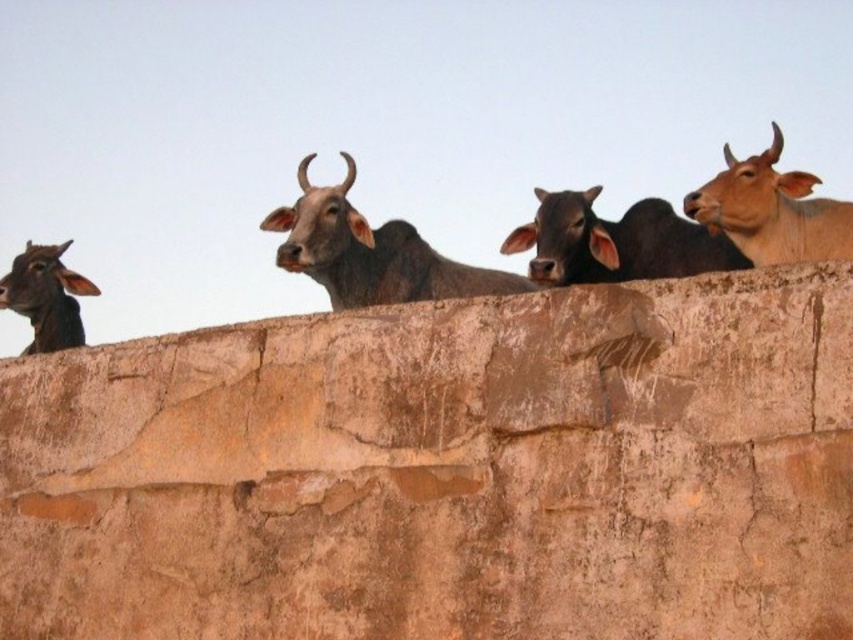
Does shiny brown bull at center have a lesser height compared to light brown smooth cow at upper right?

Indeed, shiny brown bull at center has a lesser height compared to light brown smooth cow at upper right.

Who is lower down, shiny brown bull at center or light brown smooth cow at upper right?

shiny brown bull at center is below.

Is point (344, 193) positioned in front of point (837, 240)?

That is False.

You are a GUI agent. You are given a task and a screenshot of the screen. Output one action in this format:
    pyautogui.click(x=<x>, y=<y>)
    Task: Click on the shiny brown bull at center
    The image size is (853, 640).
    Given the screenshot: What is the action you would take?
    pyautogui.click(x=370, y=252)

Who is more distant from viewer, (692, 384) or (556, 262)?

The point (556, 262) is behind.

Which of these two, brown rough stone at center or brown matte cow at center, stands shorter?

Standing shorter between the two is brown matte cow at center.

Measure the distance between brown rough stone at center and camera.

37.15 meters

Find the location of a particular element. Image resolution: width=853 pixels, height=640 pixels. brown rough stone at center is located at coordinates [445, 472].

Is brown matte cow at center bigger than shiny black bull at left?

Actually, brown matte cow at center might be smaller than shiny black bull at left.

In the scene shown: Does brown matte cow at center appear under shiny black bull at left?

No, brown matte cow at center is not below shiny black bull at left.

What do you see at coordinates (614, 241) in the screenshot? I see `brown matte cow at center` at bounding box center [614, 241].

Find the location of a particular element. brown matte cow at center is located at coordinates tap(614, 241).